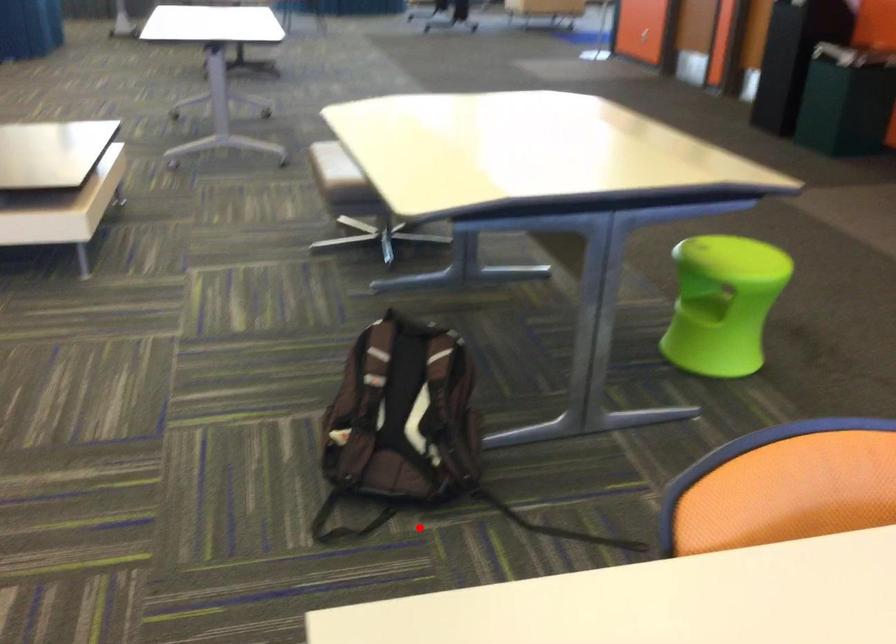
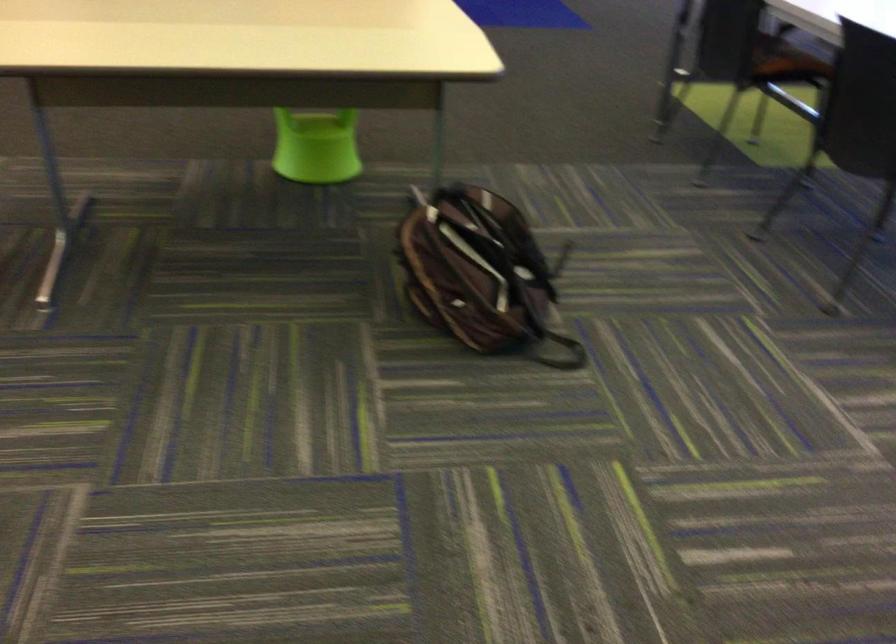
In the second image, find the point that corresponds to the highlighted location in the first image.

(552, 322)